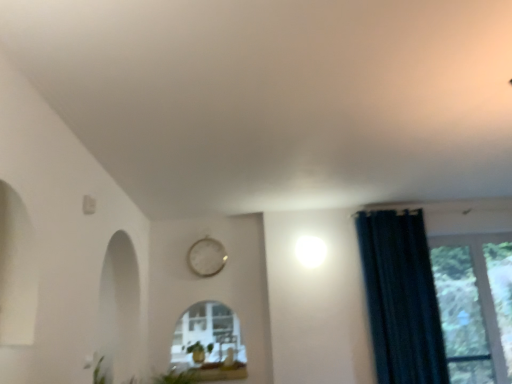
Image resolution: width=512 pixels, height=384 pixels. Find the location of `white metallic clock at upper center`. white metallic clock at upper center is located at coordinates (207, 257).

The height and width of the screenshot is (384, 512). In order to click on dark blue fabric curtain at right in this screenshot , I will do `click(401, 298)`.

Locate an element on the screen. This screenshot has width=512, height=384. white metallic clock at upper center is located at coordinates (207, 257).

Are transparent glass window at right and dark blue fabric curtain at right far apart?

No, transparent glass window at right is in close proximity to dark blue fabric curtain at right.

Which object is wider, transparent glass window at right or dark blue fabric curtain at right?

Wider between the two is dark blue fabric curtain at right.

Is the position of transparent glass window at right less distant than that of dark blue fabric curtain at right?

No, transparent glass window at right is further to the viewer.

Consider the image. Considering the relative positions of transparent glass window at right and dark blue fabric curtain at right in the image provided, is transparent glass window at right to the right of dark blue fabric curtain at right from the viewer's perspective?

Yes.

Is point (210, 247) farther from camera compared to point (229, 376)?

That is True.

Is white metallic clock at upper center to the left or to the right of white glossy window sill at lower center in the image?

Based on their positions, white metallic clock at upper center is located to the left of white glossy window sill at lower center.

Identify the location of clock on the left of white glossy window sill at lower center. (207, 257).

In the scene shown: Is white metallic clock at upper center positioned with its back to white glossy window sill at lower center?

No, white metallic clock at upper center is not facing the opposite direction of white glossy window sill at lower center.

Is transparent glass window at right bigger than white glossy window sill at lower center?

Yes.

Is transparent glass window at right turned away from white glossy window sill at lower center?

transparent glass window at right is not turned away from white glossy window sill at lower center.

From a real-world perspective, is transparent glass window at right positioned above or below white glossy window sill at lower center?

transparent glass window at right is situated higher than white glossy window sill at lower center in the real world.

How different are the orientations of transparent glass window at right and white glossy window sill at lower center in degrees?

0.0292 degrees separate the facing orientations of transparent glass window at right and white glossy window sill at lower center.

Which is behind, point (238, 373) or point (413, 328)?

The point (238, 373) is more distant.

Is white glossy window sill at lower center at the right side of dark blue fabric curtain at right?

No, white glossy window sill at lower center is not to the right of dark blue fabric curtain at right.

Does white glossy window sill at lower center lie in front of dark blue fabric curtain at right?

No, the depth of white glossy window sill at lower center is greater than that of dark blue fabric curtain at right.

Is dark blue fabric curtain at right at the back of white glossy window sill at lower center?

No.

Is point (370, 247) closer or farther from the camera than point (455, 365)?

Clearly, point (370, 247) is closer to the camera than point (455, 365).

Does dark blue fabric curtain at right have a lesser height compared to transparent glass window at right?

Incorrect, the height of dark blue fabric curtain at right does not fall short of that of transparent glass window at right.

Consider the image. How many degrees apart are the facing directions of dark blue fabric curtain at right and transparent glass window at right?

The angular difference between dark blue fabric curtain at right and transparent glass window at right is 0.0348 degrees.

Is transparent glass window at right at the back of dark blue fabric curtain at right?

No, dark blue fabric curtain at right is not facing away from transparent glass window at right.

Which is in front, transparent glass window at right or green matte plant at lower center?

green matte plant at lower center.

How many degrees apart are the facing directions of transparent glass window at right and green matte plant at lower center?

They differ by 0.6 degrees in their facing directions.

From the image's perspective, which one is positioned lower, transparent glass window at right or green matte plant at lower center?

green matte plant at lower center appears lower in the image.

Is transparent glass window at right next to green matte plant at lower center?

They are not placed beside each other.

The height and width of the screenshot is (384, 512). In order to click on window sill below the dark blue fabric curtain at right (from the image's perspective) in this screenshot , I will do `click(218, 372)`.

Is dark blue fabric curtain at right facing towards white glossy window sill at lower center?

No, dark blue fabric curtain at right is not oriented towards white glossy window sill at lower center.

Can you tell me how much dark blue fabric curtain at right and white glossy window sill at lower center differ in facing direction?

dark blue fabric curtain at right and white glossy window sill at lower center are facing 0.0599 degrees away from each other.

Does point (387, 218) come farther from viewer compared to point (229, 373)?

Yes, point (387, 218) is behind point (229, 373).

In the image, there is a transparent glass window at right. Where is `curtain above it (from the image's perspective)`? Image resolution: width=512 pixels, height=384 pixels. curtain above it (from the image's perspective) is located at coordinates (401, 298).

Image resolution: width=512 pixels, height=384 pixels. What are the coordinates of `clock on the left of white glossy window sill at lower center` in the screenshot? It's located at (207, 257).

Estimate the real-world distances between objects in this image. Which object is closer to white metallic clock at upper center, white glossy window sill at lower center or green matte plant at lower center?

The object closer to white metallic clock at upper center is green matte plant at lower center.

Estimate the real-world distances between objects in this image. Which object is closer to white metallic clock at upper center, dark blue fabric curtain at right or white glossy window sill at lower center?

Based on the image, white glossy window sill at lower center appears to be nearer to white metallic clock at upper center.

Considering their positions, is white glossy window sill at lower center positioned closer to green matte plant at lower center than white metallic clock at upper center?

white glossy window sill at lower center is positioned closer to the anchor green matte plant at lower center.

In the scene shown: Which object lies further to the anchor point white glossy window sill at lower center, dark blue fabric curtain at right or transparent glass window at right?

Among the two, transparent glass window at right is located further to white glossy window sill at lower center.

Looking at the image, which one is located further to dark blue fabric curtain at right, white metallic clock at upper center or transparent glass window at right?

white metallic clock at upper center is positioned further to the anchor dark blue fabric curtain at right.

Estimate the real-world distances between objects in this image. Which object is closer to white glossy window sill at lower center, green matte plant at lower center or transparent glass window at right?

Among the two, green matte plant at lower center is located nearer to white glossy window sill at lower center.

From the image, which object appears to be farther from transparent glass window at right, white glossy window sill at lower center or white metallic clock at upper center?

white metallic clock at upper center lies further to transparent glass window at right than the other object.

Looking at the image, which one is located closer to white glossy window sill at lower center, dark blue fabric curtain at right or white metallic clock at upper center?

white metallic clock at upper center lies closer to white glossy window sill at lower center than the other object.

Where is `window sill between green matte plant at lower center and dark blue fabric curtain at right`? window sill between green matte plant at lower center and dark blue fabric curtain at right is located at coordinates (218, 372).

The image size is (512, 384). I want to click on curtain situated between white metallic clock at upper center and transparent glass window at right from left to right, so click(401, 298).

In order to click on clock situated between green matte plant at lower center and dark blue fabric curtain at right from left to right in this screenshot , I will do `click(207, 257)`.

Find the location of a particular element. The height and width of the screenshot is (384, 512). window sill between green matte plant at lower center and transparent glass window at right from left to right is located at coordinates (218, 372).